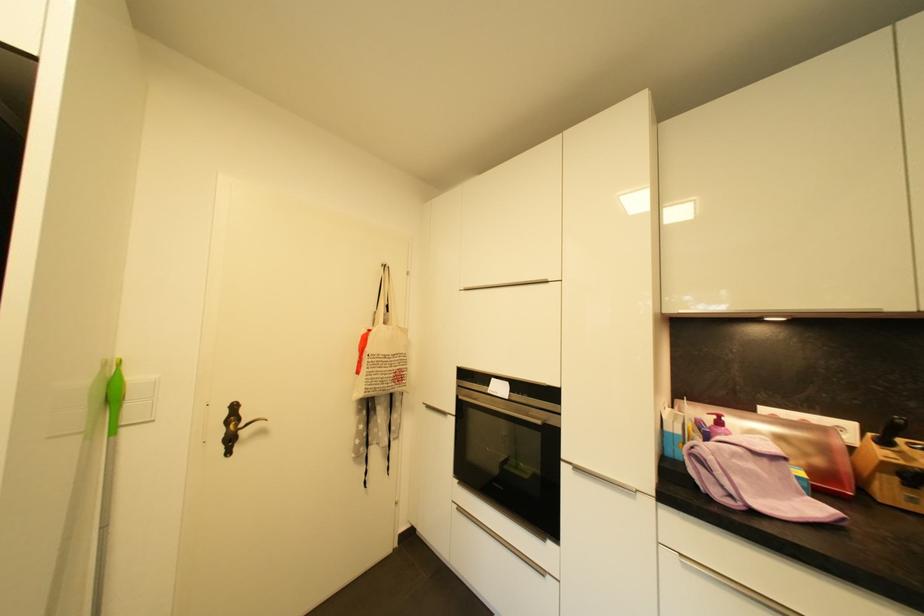
In order to click on cloth tote bag in this screenshot , I will do `click(380, 379)`.